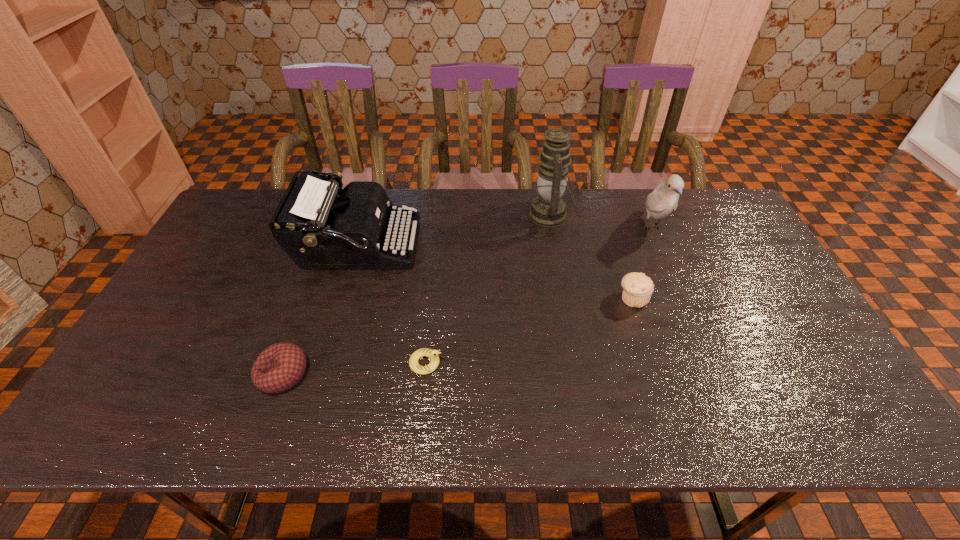
I want to click on the fourth object from left to right, so click(x=548, y=209).

The height and width of the screenshot is (540, 960). I want to click on oil lamp, so click(x=548, y=209).

You are a GUI agent. You are given a task and a screenshot of the screen. Output one action in this format:
    pyautogui.click(x=<x>, y=<y>)
    Task: Click on the bird
    This screenshot has width=960, height=540.
    Given the screenshot: What is the action you would take?
    pyautogui.click(x=663, y=200)

Locate an element on the screen. The height and width of the screenshot is (540, 960). typewriter is located at coordinates (318, 230).

Locate an element on the screen. The width and height of the screenshot is (960, 540). the fourth farthest object is located at coordinates (637, 288).

You are a GUI agent. You are given a task and a screenshot of the screen. Output one action in this format:
    pyautogui.click(x=<x>, y=<y>)
    Task: Click on the muffin
    
    Given the screenshot: What is the action you would take?
    pyautogui.click(x=637, y=288)

At what (x,y) coordinates should I click in order to perform the action: click on beanbag. Please return your answer as a coordinate pair (x, y). The height and width of the screenshot is (540, 960). Looking at the image, I should click on (279, 367).

The height and width of the screenshot is (540, 960). In order to click on duckling in this screenshot , I will do `click(432, 354)`.

You are a GUI agent. You are given a task and a screenshot of the screen. Output one action in this format:
    pyautogui.click(x=<x>, y=<y>)
    Task: Click on the third object from left to right
    This screenshot has width=960, height=540.
    Given the screenshot: What is the action you would take?
    pyautogui.click(x=432, y=354)

The width and height of the screenshot is (960, 540). Find the location of `vacant region located on the right of the oil lamp`. vacant region located on the right of the oil lamp is located at coordinates (x=631, y=215).